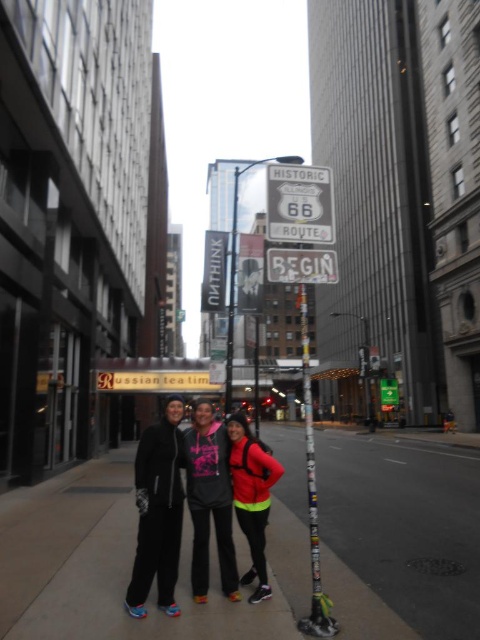
You are a tailor measuring jackets for alterations. You need to determine if the distance between the matte black jacket at center and the black fleece jacket at center is sufficient to allow a 5.5 inch ruler to be placed between them without touching either jacket. Can you confirm this?

The distance between the matte black jacket at center and the black fleece jacket at center is 6.04 inches. Since the ruler is 5.5 inches long, it can be placed between them without touching either jacket as there is enough space.

You are a delivery drone flying above the urban street scene. You need to land on the smooth concrete sidewalk at center while avoiding the black matte jacket at center. Can you safely land there?

The smooth concrete sidewalk at center is below the black matte jacket at center, so the drone cannot safely land there as the jacket is blocking the sidewalk.

Based on the photo, you are a photographer wanting to capture both the matte black jacket at center and the black fleece jacket at center in a single frame. Given that your camera has a limited focus range, which jacket should you adjust your focus on to ensure both are in focus, considering their sizes?

The matte black jacket at center is larger in width than the black fleece jacket at center, so adjusting focus on the larger matte black jacket at center will help ensure both are in focus as it occupies more of the frame.